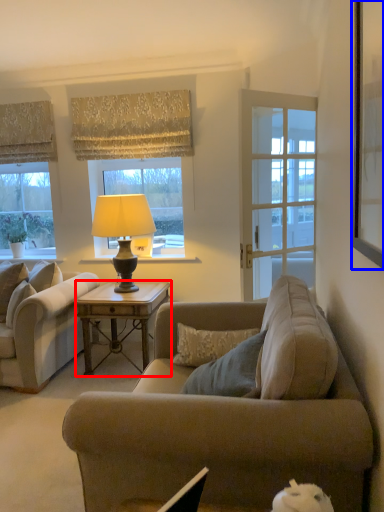
Question: Among these objects, which one is farthest to the camera, desk (highlighted by a red box) or picture frame (highlighted by a blue box)?

Choices:
 (A) desk
 (B) picture frame

Answer: (A)